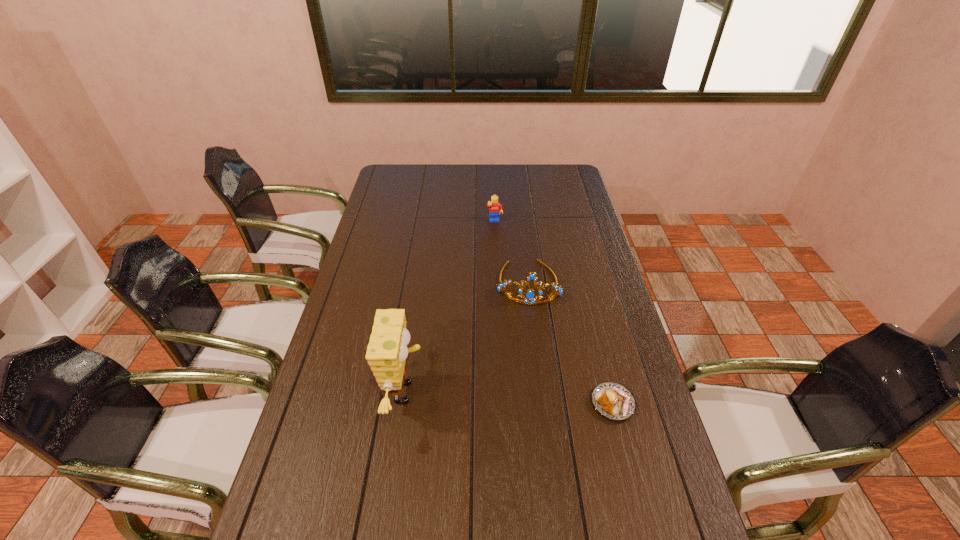
Where is `vacant region located 0.110m on the face of the third tallest object`? The height and width of the screenshot is (540, 960). vacant region located 0.110m on the face of the third tallest object is located at coordinates (498, 242).

Find the location of a particular element. Image resolution: width=960 pixels, height=540 pixels. free space located 0.140m on the face of the third tallest object is located at coordinates (498, 247).

The width and height of the screenshot is (960, 540). I want to click on vacant space located 0.100m on the face of the third tallest object, so click(497, 240).

Identify the location of vacant space located 0.240m on the front-facing side of the tiara. pyautogui.click(x=527, y=365).

What are the coordinates of `free space located 0.350m on the front-facing side of the tiara` in the screenshot? It's located at (527, 397).

Where is `vacant space located on the front-facing side of the tiara`? The height and width of the screenshot is (540, 960). vacant space located on the front-facing side of the tiara is located at coordinates (526, 410).

Where is `object that is at the right edge`? object that is at the right edge is located at coordinates (611, 400).

Identify the location of free space at the far edge of the desktop. Image resolution: width=960 pixels, height=540 pixels. (483, 181).

Image resolution: width=960 pixels, height=540 pixels. Find the location of `vacant space at the left edge`. vacant space at the left edge is located at coordinates (331, 429).

At what (x,y) coordinates should I click in order to perform the action: click on vacant area at the right edge of the desktop. Please return your answer as a coordinate pair (x, y). The height and width of the screenshot is (540, 960). Looking at the image, I should click on (x=566, y=223).